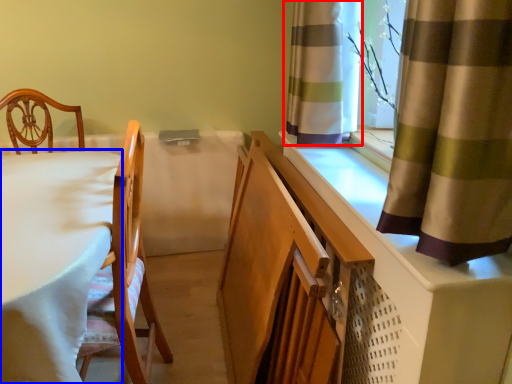
Question: Among these objects, which one is nearest to the camera, curtain (highlighted by a red box) or table (highlighted by a blue box)?

Choices:
 (A) curtain
 (B) table

Answer: (B)